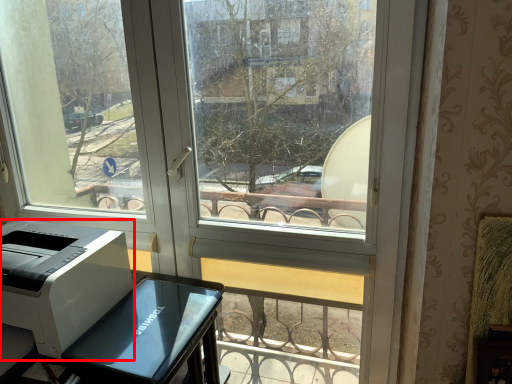
Question: Where is printer (annotated by the red box) located in relation to furniture in the image?

Choices:
 (A) right
 (B) left

Answer: (B)